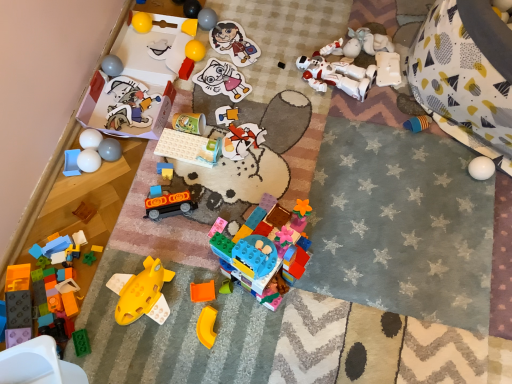
This screenshot has width=512, height=384. I want to click on vacant area that lies in front of white glossy ball at left, the nineteenth toy in the right-to-left sequence, so click(86, 212).